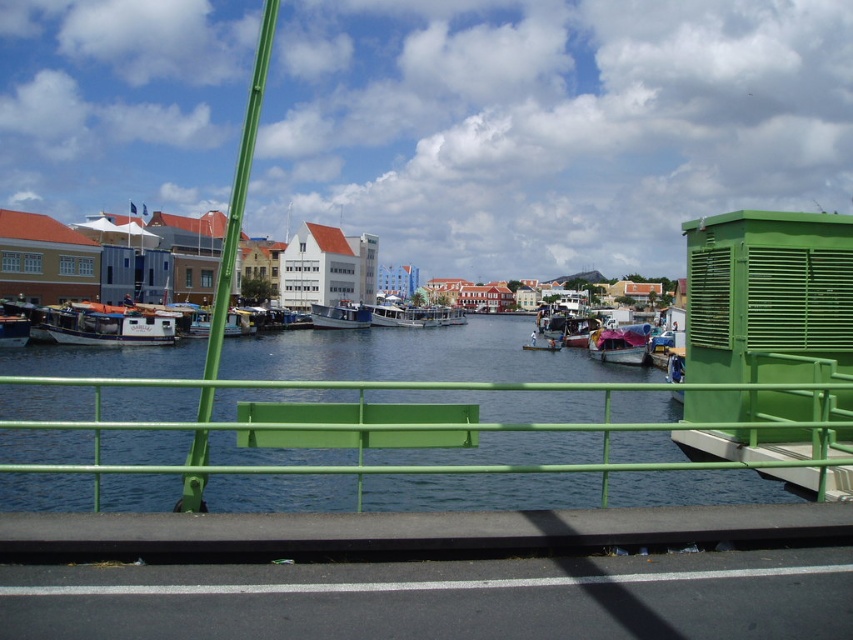
Who is shorter, metallic pink boat at center or white wooden boat at center?

Standing shorter between the two is metallic pink boat at center.

Between point (619, 339) and point (206, 337), which one is positioned in front?

Point (619, 339)

Locate an element on the screen. metallic pink boat at center is located at coordinates (619, 344).

This screenshot has width=853, height=640. What do you see at coordinates (431, 428) in the screenshot?
I see `green matte bench at center` at bounding box center [431, 428].

Is green matte bench at center thinner than white wooden boat at center?

In fact, green matte bench at center might be wider than white wooden boat at center.

Is point (766, 384) closer to viewer compared to point (195, 333)?

That is True.

The height and width of the screenshot is (640, 853). Identify the location of green matte bench at center. (431, 428).

Does white matte boat at left have a greater width compared to metallic pink boat at center?

Yes.

Can you confirm if white matte boat at left is bigger than metallic pink boat at center?

Yes, white matte boat at left is bigger than metallic pink boat at center.

Between point (65, 308) and point (621, 326), which one is positioned in front?

Point (621, 326) is in front.

Locate an element on the screen. white matte boat at left is located at coordinates (109, 324).